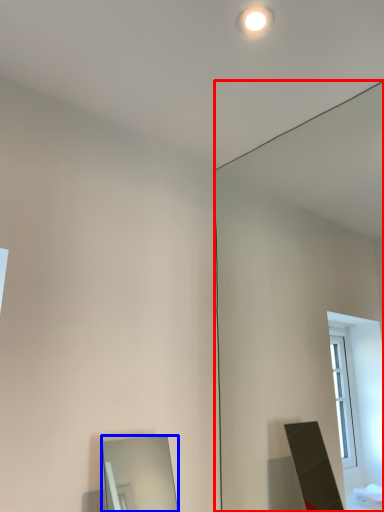
Question: Which object is further to the camera taking this photo, mirror (highlighted by a red box) or mirror (highlighted by a blue box)?

Choices:
 (A) mirror
 (B) mirror

Answer: (B)